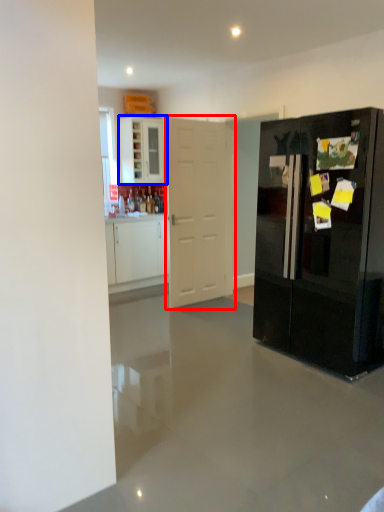
Question: Which point is further to the camera, door (highlighted by a red box) or cabinetry (highlighted by a blue box)?

Choices:
 (A) door
 (B) cabinetry

Answer: (B)